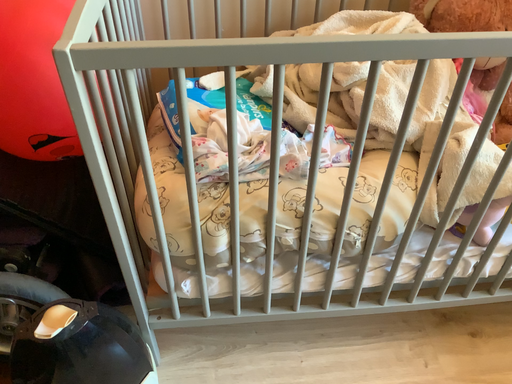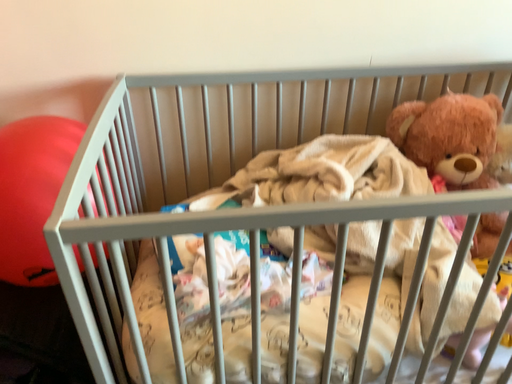
Question: How did the camera likely rotate when shooting the video?

Choices:
 (A) rotated downward
 (B) rotated upward

Answer: (B)